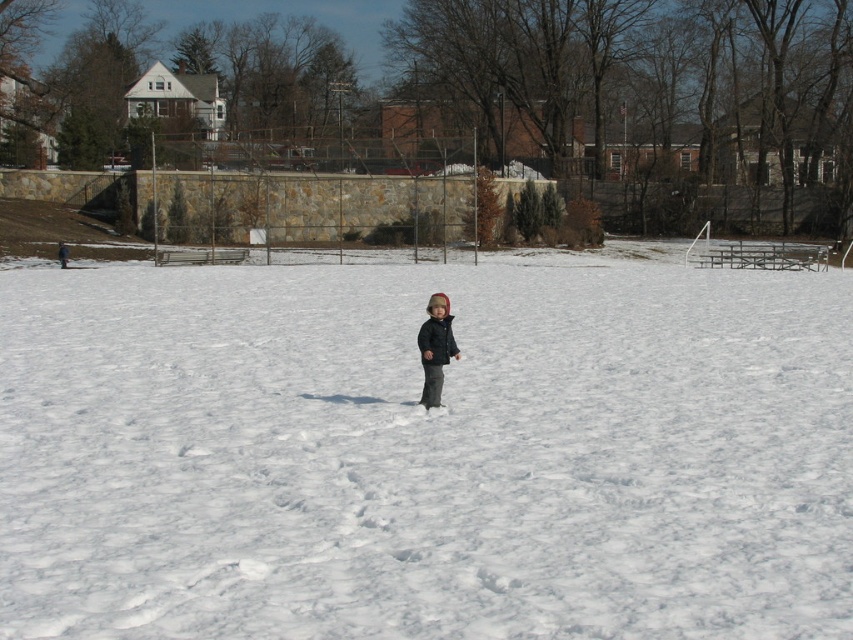
Question: Which is farther from the dark blue matte jacket at center?

Choices:
 (A) dark gray fleece jacket at center
 (B) white fluffy snow at center

Answer: (B)

Question: Considering the relative positions of white fluffy snow at center and dark gray fleece jacket at center in the image provided, where is white fluffy snow at center located with respect to dark gray fleece jacket at center?

Choices:
 (A) left
 (B) right

Answer: (A)

Question: Is dark gray fleece jacket at center to the left of dark blue matte jacket at center from the viewer's perspective?

Choices:
 (A) no
 (B) yes

Answer: (B)

Question: Among these points, which one is nearest to the camera?

Choices:
 (A) (436, 397)
 (B) (456, 348)
 (C) (263, 449)

Answer: (C)

Question: Estimate the real-world distances between objects in this image. Which object is farther from the white fluffy snow at center?

Choices:
 (A) dark gray fleece jacket at center
 (B) dark blue matte jacket at center

Answer: (A)

Question: Does white fluffy snow at center appear on the left side of dark blue matte jacket at center?

Choices:
 (A) no
 (B) yes

Answer: (B)